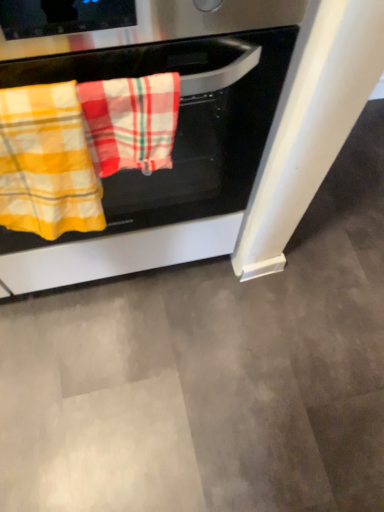
Question: Is point (135, 109) positioned closer to the camera than point (41, 158)?

Choices:
 (A) farther
 (B) closer

Answer: (B)

Question: Considering the positions of plaid cotton beach towel at center, the second beach towel viewed from the left, and yellow plaid towel at left, positioned as the 1th beach towel in left-to-right order, in the image, is plaid cotton beach towel at center, the second beach towel viewed from the left, taller or shorter than yellow plaid towel at left, positioned as the 1th beach towel in left-to-right order,?

Choices:
 (A) tall
 (B) short

Answer: (B)

Question: Which of these objects is positioned closest to the plaid cotton beach towel at center, acting as the 1th beach towel starting from the right?

Choices:
 (A) stainless steel oven at center
 (B) yellow plaid towel at left, positioned as the 1th beach towel in left-to-right order

Answer: (B)

Question: Based on their relative distances, which object is farther from the plaid cotton beach towel at center, acting as the 1th beach towel starting from the right?

Choices:
 (A) stainless steel oven at center
 (B) yellow plaid towel at left, positioned as the 1th beach towel in left-to-right order

Answer: (A)